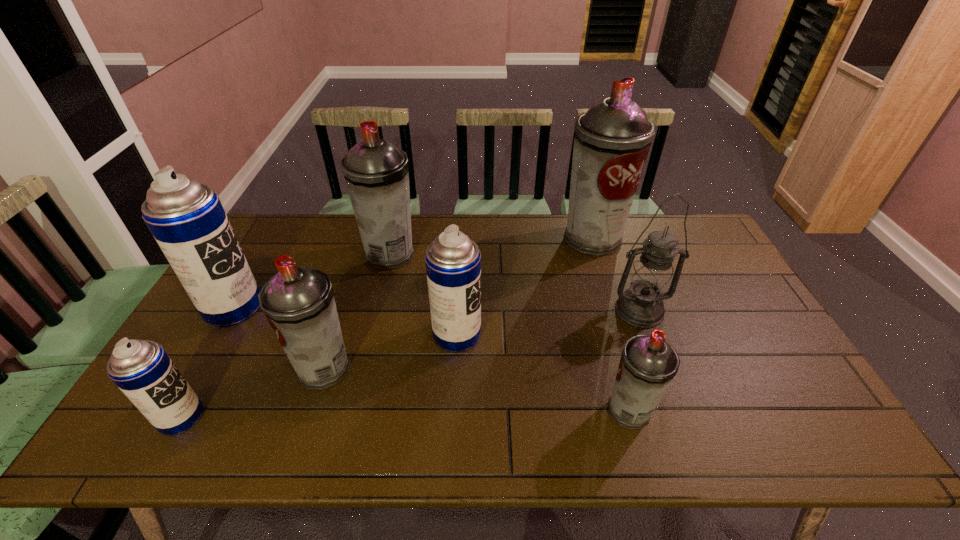
Locate an element on the screen. free space at the near edge of the desktop is located at coordinates (210, 436).

In the image, there is a desktop. Find the location of `vacant region at the left edge`. vacant region at the left edge is located at coordinates (272, 271).

In the image, there is a desktop. Identify the location of vacant space at the far right corner. (707, 246).

Where is `free point between the smallest gray aerosol can and the rightmost blue aerosol can`? This screenshot has width=960, height=540. free point between the smallest gray aerosol can and the rightmost blue aerosol can is located at coordinates (543, 373).

Locate an element on the screen. empty space that is in between the smallest gray aerosol can and the third smallest gray aerosol can is located at coordinates (510, 332).

Locate an element on the screen. This screenshot has height=540, width=960. unoccupied position between the third smallest gray aerosol can and the tallest object is located at coordinates (492, 246).

Where is `free space between the smallest blue aerosol can and the smallest gray aerosol can`? free space between the smallest blue aerosol can and the smallest gray aerosol can is located at coordinates (405, 414).

You are a GUI agent. You are given a task and a screenshot of the screen. Output one action in this format:
    pyautogui.click(x=<x>, y=<y>)
    Task: Click on the free space between the third biggest gray aerosol can and the smallest gray aerosol can
    
    Given the screenshot: What is the action you would take?
    pyautogui.click(x=477, y=389)

The image size is (960, 540). I want to click on free point between the second biggest gray aerosol can and the second smallest blue aerosol can, so click(423, 294).

You are a GUI agent. You are given a task and a screenshot of the screen. Output one action in this format:
    pyautogui.click(x=<x>, y=<y>)
    Task: Click on the empty space between the oil lamp and the biggest gray aerosol can
    
    Given the screenshot: What is the action you would take?
    pyautogui.click(x=615, y=274)